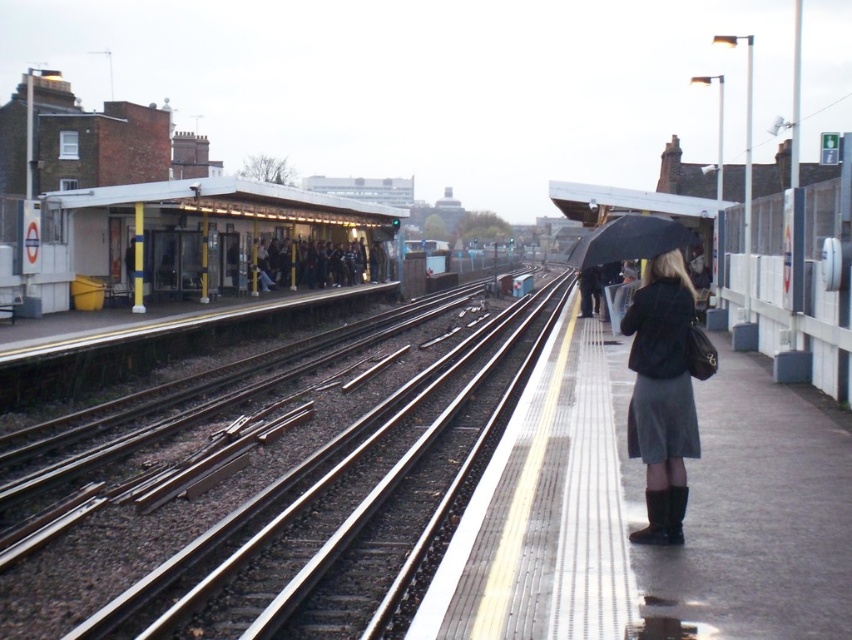
Does matte black jacket at center come in front of dark gray fabric coat at upper center?

Yes.

Can you confirm if matte black jacket at center is thinner than dark gray fabric coat at upper center?

Yes.

Describe the element at coordinates (661, 394) in the screenshot. I see `matte black jacket at center` at that location.

This screenshot has height=640, width=852. I want to click on matte black jacket at center, so click(661, 394).

How much distance is there between dark gray concrete platform at right and white plastic shelter at upper left?

dark gray concrete platform at right is 16.85 meters away from white plastic shelter at upper left.

Identify the location of dark gray concrete platform at right. (643, 515).

Does dark gray concrete platform at right have a lesser width compared to matte black jacket at center?

No.

Is dark gray concrete platform at right smaller than matte black jacket at center?

No, dark gray concrete platform at right is not smaller than matte black jacket at center.

Which is behind, point (847, 529) or point (671, 483)?

Point (847, 529)

The width and height of the screenshot is (852, 640). Identify the location of dark gray concrete platform at right. (643, 515).